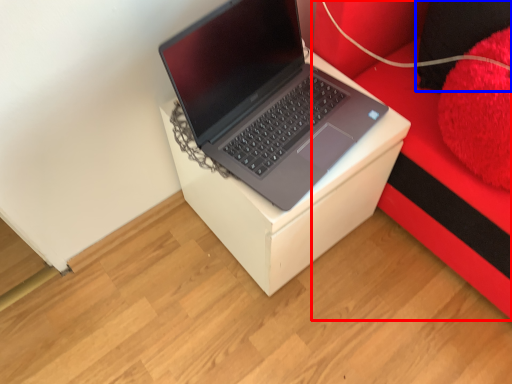
Question: Which of the following is the closest to the observer, furniture (highlighted by a red box) or pillow (highlighted by a blue box)?

Choices:
 (A) furniture
 (B) pillow

Answer: (A)